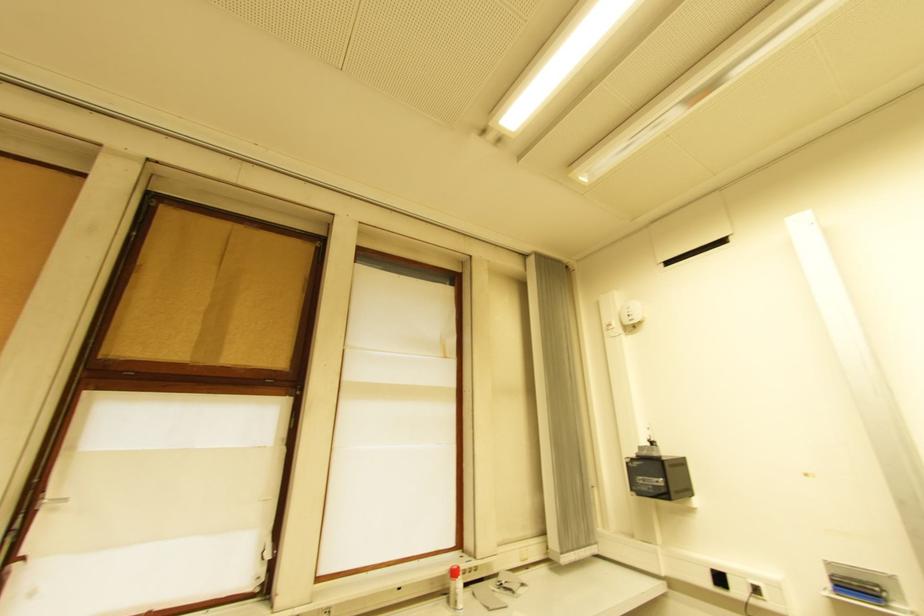
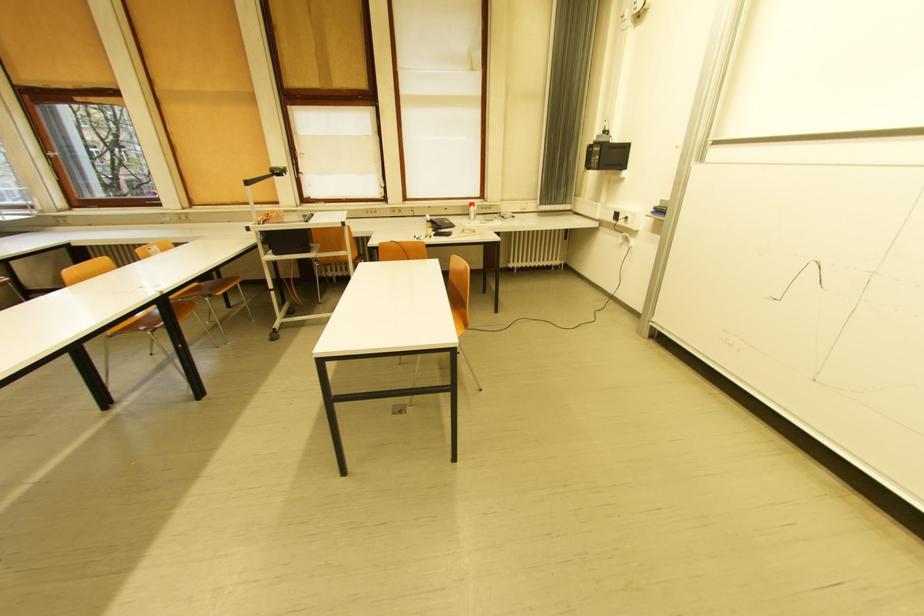
In the second image, find the point that corresponds to the point at 639,492 in the first image.

(592, 168)